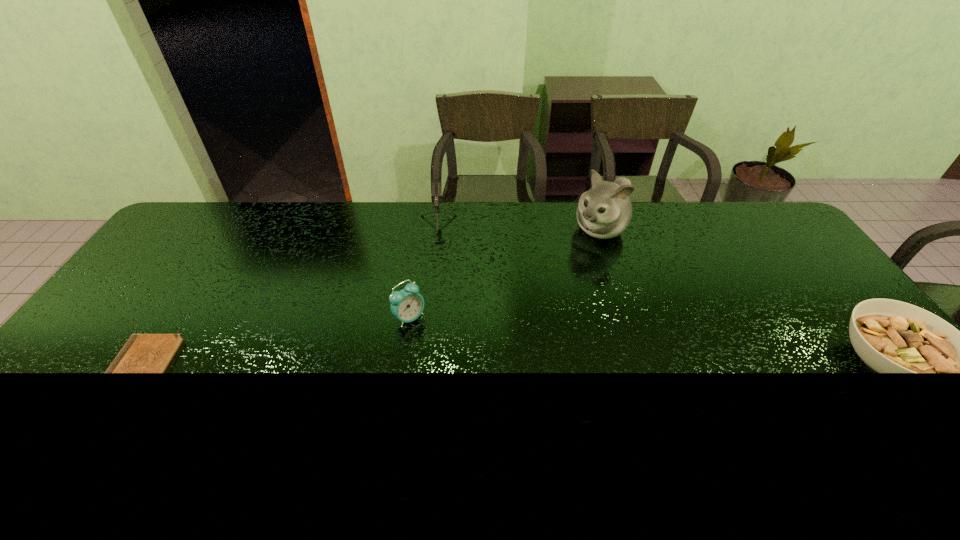
This screenshot has height=540, width=960. I want to click on diary, so click(x=143, y=353).

You are a GUI agent. You are given a task and a screenshot of the screen. Output one action in this format:
    pyautogui.click(x=<x>, y=<y>)
    Task: Click on the leftmost object
    The image size is (960, 540).
    Given the screenshot: What is the action you would take?
    pyautogui.click(x=143, y=353)

This screenshot has height=540, width=960. Find the location of `microphone`. microphone is located at coordinates (436, 186).

Find the location of a particular element. Image resolution: width=960 pixels, height=540 pixels. the tallest object is located at coordinates (604, 211).

The height and width of the screenshot is (540, 960). I want to click on the second object from right to left, so click(604, 211).

Identify the location of alarm clock. The height and width of the screenshot is (540, 960). (407, 305).

Identify the location of free space located on the spine side of the diary. (64, 368).

Where is `free space located on the spine side of the diary`? free space located on the spine side of the diary is located at coordinates (84, 368).

Where is `vacant space located on the stand of the microphone`? vacant space located on the stand of the microphone is located at coordinates (432, 277).

Locate an element on the screen. vacant space located 0.310m on the stand of the microphone is located at coordinates (427, 327).